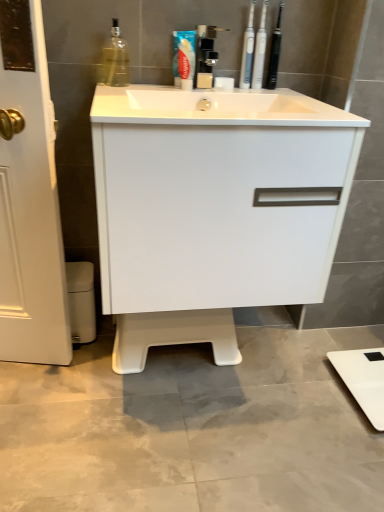
You are a GUI agent. You are given a task and a screenshot of the screen. Output one action in this format:
    pyautogui.click(x=<x>, y=<y>)
    Task: Click on the free point to the left of satin nickel faucet at upper center
    
    Given the screenshot: What is the action you would take?
    pyautogui.click(x=167, y=93)